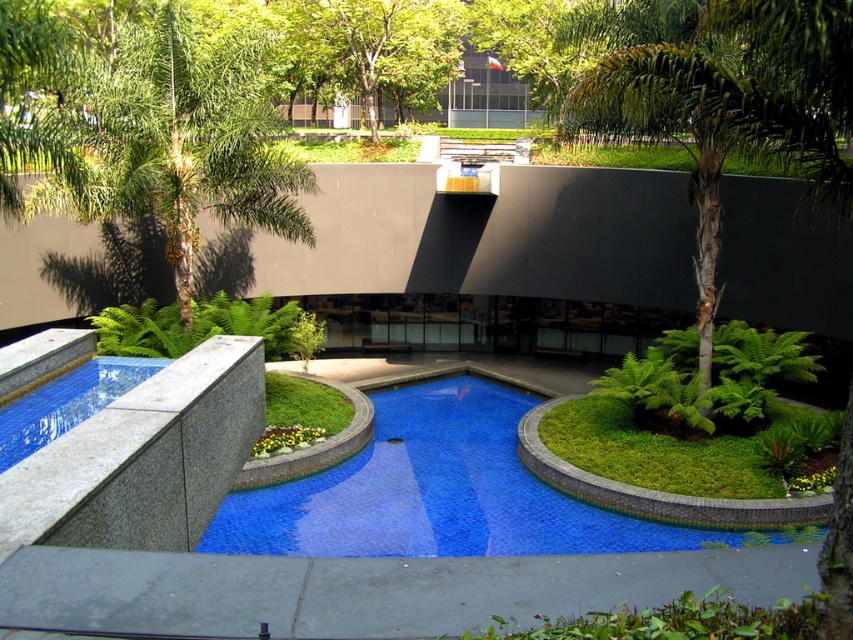
Question: Observing the image, what is the correct spatial positioning of green leafy tree at center in reference to green leafy palm tree at left?

Choices:
 (A) above
 (B) below

Answer: (B)

Question: Which point appears closest to the camera in this image?

Choices:
 (A) (776, 64)
 (B) (589, 540)
 (C) (239, 173)
 (D) (384, 76)

Answer: (A)

Question: Does green leafy tree at center appear under smooth concrete edge at lower left?

Choices:
 (A) yes
 (B) no

Answer: (B)

Question: Among these objects, which one is nearest to the camera?

Choices:
 (A) green leafy palm tree at left
 (B) blue glossy pool at center
 (C) smooth concrete edge at lower left
 (D) green leafy tree at center

Answer: (D)

Question: Is green leafy tree at center further to camera compared to green leafy palm tree at left?

Choices:
 (A) yes
 (B) no

Answer: (B)

Question: Which point is farther to the camera?

Choices:
 (A) (364, 484)
 (B) (125, 356)

Answer: (A)